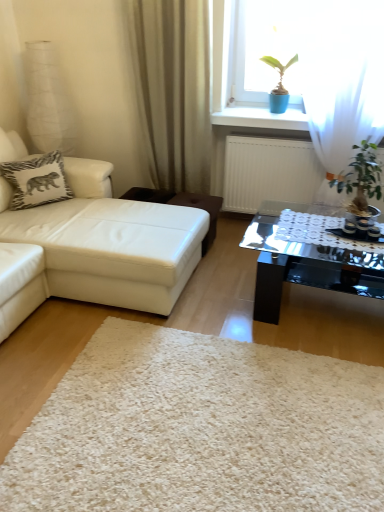
Question: Is green leafy plant at right a part of white zebra-patterned pillow at upper left?

Choices:
 (A) no
 (B) yes

Answer: (A)

Question: Are white zebra-patterned pillow at upper left and green leafy plant at right making contact?

Choices:
 (A) no
 (B) yes

Answer: (A)

Question: Considering the relative sizes of white zebra-patterned pillow at upper left and green leafy plant at right in the image provided, is white zebra-patterned pillow at upper left shorter than green leafy plant at right?

Choices:
 (A) yes
 (B) no

Answer: (A)

Question: Is green leafy plant at right at the back of white zebra-patterned pillow at upper left?

Choices:
 (A) yes
 (B) no

Answer: (B)

Question: From the image's perspective, is white zebra-patterned pillow at upper left located beneath green leafy plant at right?

Choices:
 (A) no
 (B) yes

Answer: (A)

Question: Is white leather studio couch at left wider or thinner than white shaggy rug at center?

Choices:
 (A) wide
 (B) thin

Answer: (A)

Question: Considering their positions, is white leather studio couch at left located in front of or behind white shaggy rug at center?

Choices:
 (A) behind
 (B) front

Answer: (A)

Question: Based on their positions, is white leather studio couch at left located to the left or right of white shaggy rug at center?

Choices:
 (A) right
 (B) left

Answer: (B)

Question: Choose the correct answer: Is white leather studio couch at left inside white shaggy rug at center or outside it?

Choices:
 (A) inside
 (B) outside

Answer: (B)

Question: From a real-world perspective, is green leafy plant at right physically located above or below white shaggy rug at center?

Choices:
 (A) above
 (B) below

Answer: (A)

Question: Looking at their shapes, would you say green leafy plant at right is wider or thinner than white shaggy rug at center?

Choices:
 (A) thin
 (B) wide

Answer: (A)

Question: Would you say green leafy plant at right is to the left or to the right of white shaggy rug at center in the picture?

Choices:
 (A) left
 (B) right

Answer: (B)

Question: Do you think green leafy plant at right is within white shaggy rug at center, or outside of it?

Choices:
 (A) inside
 (B) outside

Answer: (B)

Question: Visually, is white shaggy rug at center positioned to the left or to the right of white leather studio couch at left?

Choices:
 (A) left
 (B) right

Answer: (B)

Question: In terms of width, does white shaggy rug at center look wider or thinner when compared to white leather studio couch at left?

Choices:
 (A) wide
 (B) thin

Answer: (B)